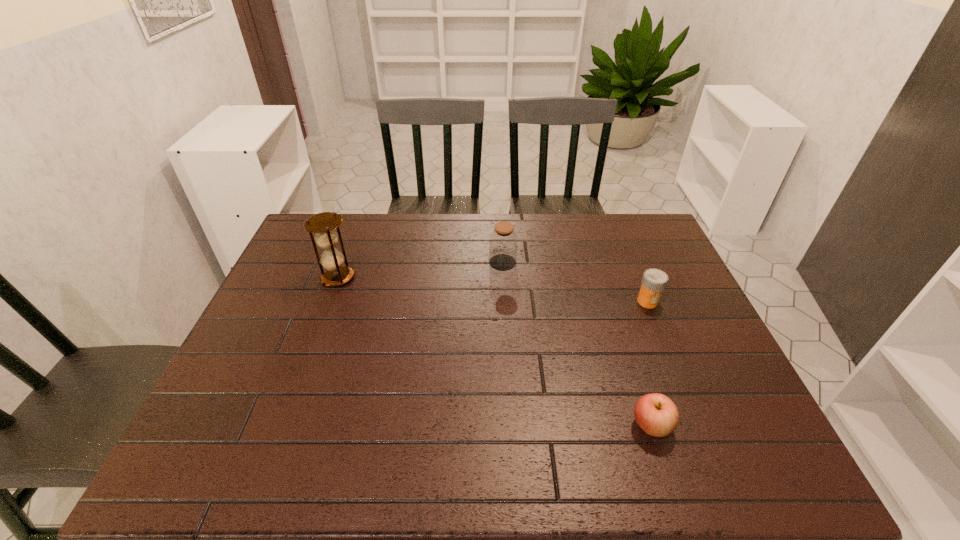
Where is `free space between the nearest object and the second nearest object`? The height and width of the screenshot is (540, 960). free space between the nearest object and the second nearest object is located at coordinates tap(650, 363).

This screenshot has height=540, width=960. In order to click on the closest object to the third object from right to left in this screenshot , I will do `click(654, 281)`.

Locate an element on the screen. The height and width of the screenshot is (540, 960). object that is the closest one to the hourglass is located at coordinates (503, 240).

The width and height of the screenshot is (960, 540). In order to click on vacant position in the image that satisfies the following two spatial constraints: 1. on the back side of the third shortest object; 2. on the right side of the hourglass in this screenshot , I will do `click(344, 262)`.

This screenshot has height=540, width=960. In order to click on free region that satisfies the following two spatial constraints: 1. on the front side of the third object from right to left; 2. on the left side of the apple in this screenshot , I will do `click(513, 426)`.